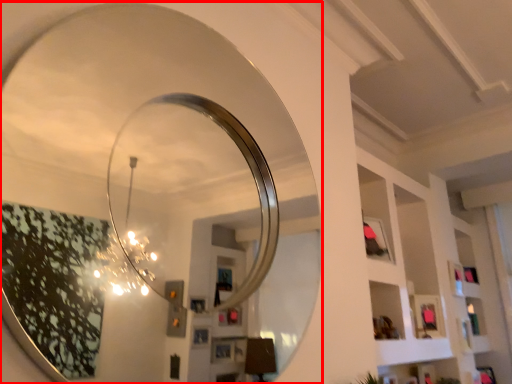
Question: Considering the relative positions of mirror (annotated by the red box) and shelf in the image provided, where is mirror (annotated by the red box) located with respect to the staircase?

Choices:
 (A) right
 (B) left

Answer: (B)